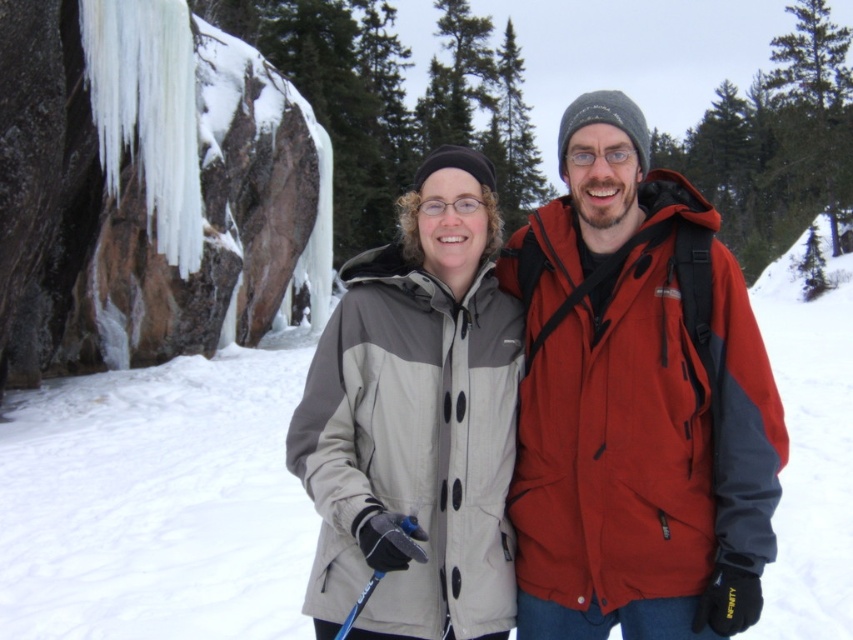
You are a photographer standing 2 meters away from the two people in the snowy scene. You want to take a group photo of the matte red jacket at center and the gray matte jacket at center. Can you fit both subjects in the frame of your camera, which has a maximum horizontal field of view of 1.5 meters?

The matte red jacket at center and gray matte jacket at center are 1.32 meters apart, which is less than the camera frame width of 1.5 meters. Therefore, both subjects can fit within the frame.

You are planning to take a photo of the gray matte jacket at center and the white fluffy snow at center. Since you want the snow to appear to the right of the jacket in the photo, will the current arrangement allow that?

Yes, the current arrangement allows the white fluffy snow at center to be on the right side of the gray matte jacket at center, so the photo will show the snow to the right of the jacket as desired.